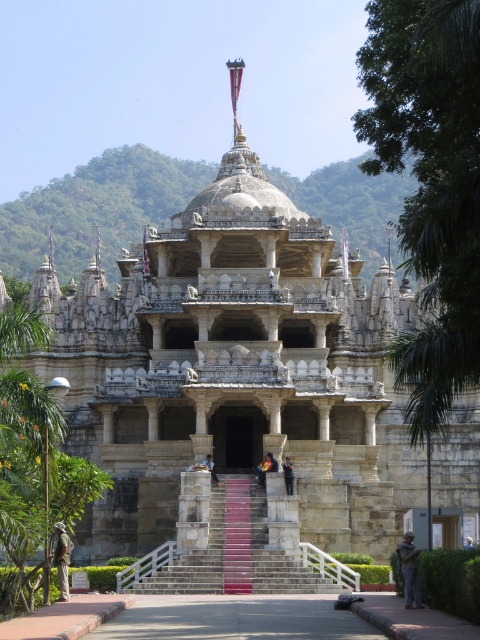
Question: Which point appears farthest from the camera in this image?

Choices:
 (A) (67, 538)
 (B) (216, 566)

Answer: (B)

Question: In this image, where is camouflage fabric jacket at lower right located relative to yellow fabric person at center?

Choices:
 (A) above
 (B) below

Answer: (B)

Question: Which of these objects is positioned farthest from the polished stone stairs at center?

Choices:
 (A) camouflage fabric jacket at lower left
 (B) camouflage fabric jacket at lower right
 (C) dark blue fabric at center
 (D) yellow fabric person at center

Answer: (A)

Question: Is camouflage fabric jacket at lower right smaller than dark blue fabric at center?

Choices:
 (A) yes
 (B) no

Answer: (B)

Question: Is yellow fabric person at center to the right of dark gray stone person at center from the viewer's perspective?

Choices:
 (A) yes
 (B) no

Answer: (B)

Question: Which of the following is the farthest from the observer?

Choices:
 (A) dark gray stone person at center
 (B) polished stone stairs at center

Answer: (A)